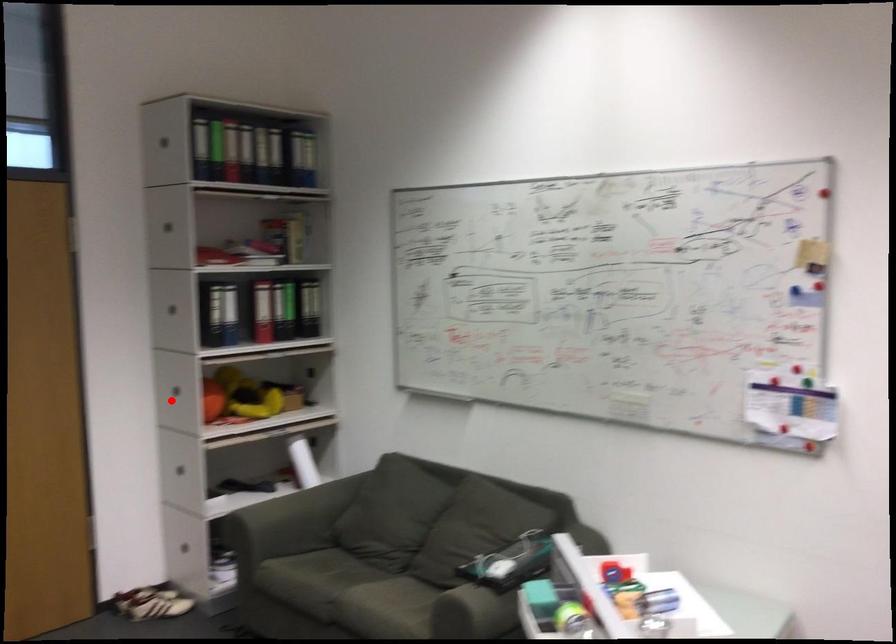
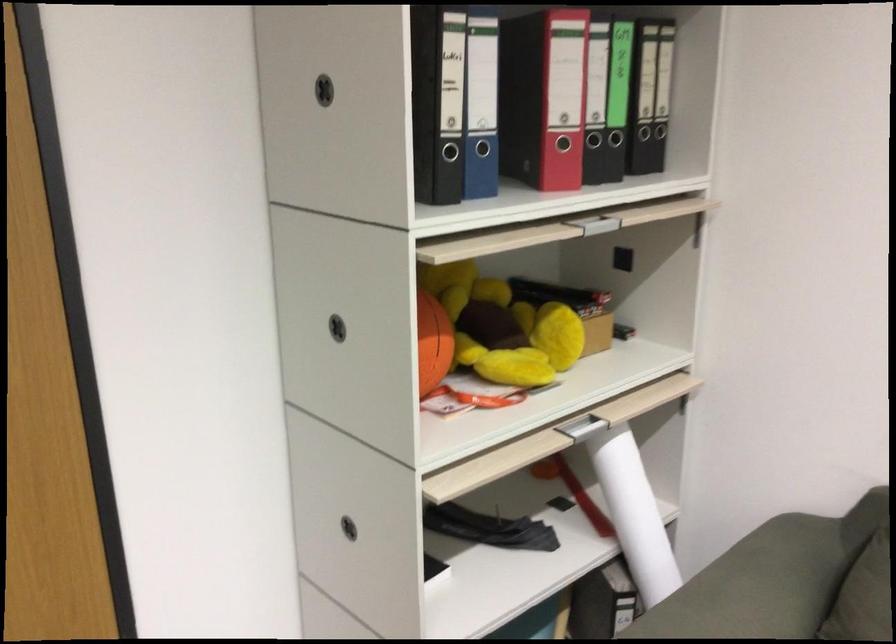
Where in the second image is the point corresponding to the highlighted location from the first image?

(337, 328)